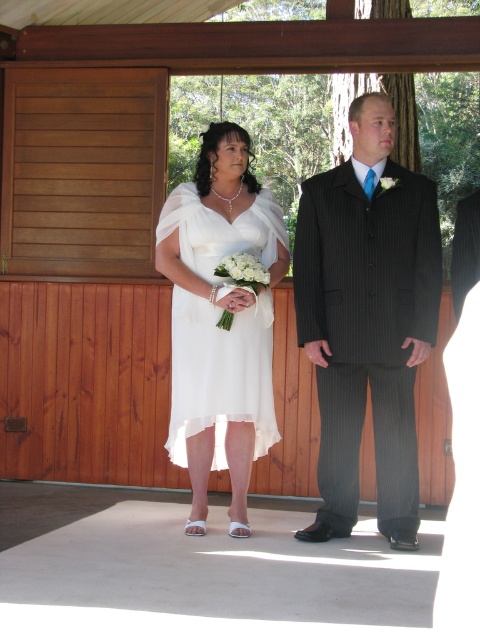
Which is in front, point (397, 314) or point (257, 416)?

Positioned in front is point (397, 314).

Does black pinstripe suit at center have a larger size compared to ivory chiffon dress at center?

Yes, black pinstripe suit at center is bigger than ivory chiffon dress at center.

Measure the distance between point (x=310, y=220) and camera.

Point (x=310, y=220) and camera are 17.96 feet apart.

In order to click on black pinstripe suit at center in this screenshot , I will do `click(367, 320)`.